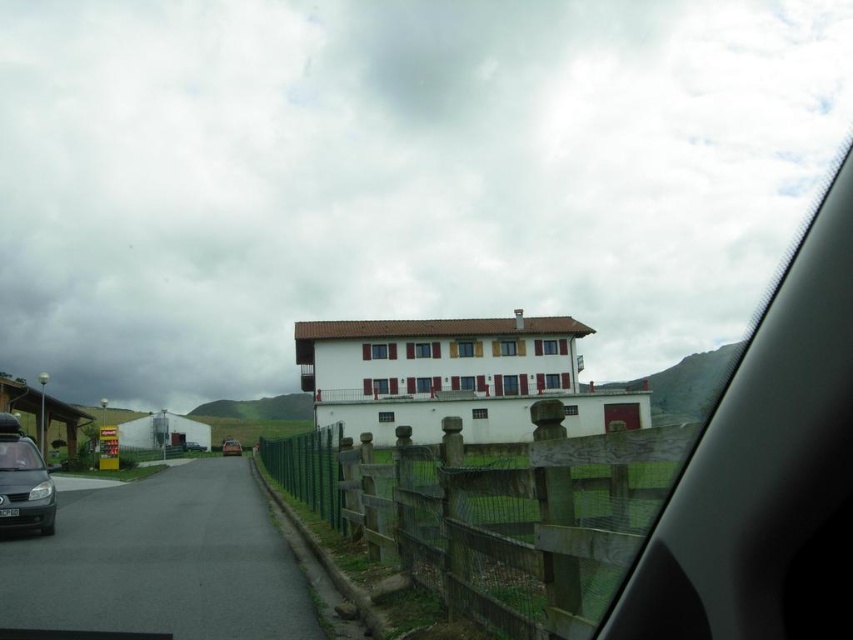
Question: Does wooden at center have a smaller size compared to matte gray car at left?

Choices:
 (A) yes
 (B) no

Answer: (B)

Question: Among these points, which one is farthest from the camera?

Choices:
 (A) (15, 481)
 (B) (618, 540)

Answer: (A)

Question: Which point appears farthest from the camera in this image?

Choices:
 (A) (3, 442)
 (B) (235, 445)

Answer: (B)

Question: Can you confirm if wooden at center is bigger than matte black car at center?

Choices:
 (A) yes
 (B) no

Answer: (A)

Question: Where is wooden at center located in relation to matte black car at center in the image?

Choices:
 (A) left
 (B) right

Answer: (B)

Question: Which object is positioned farthest from the matte gray car at left?

Choices:
 (A) matte black car at center
 (B) wooden at center

Answer: (A)